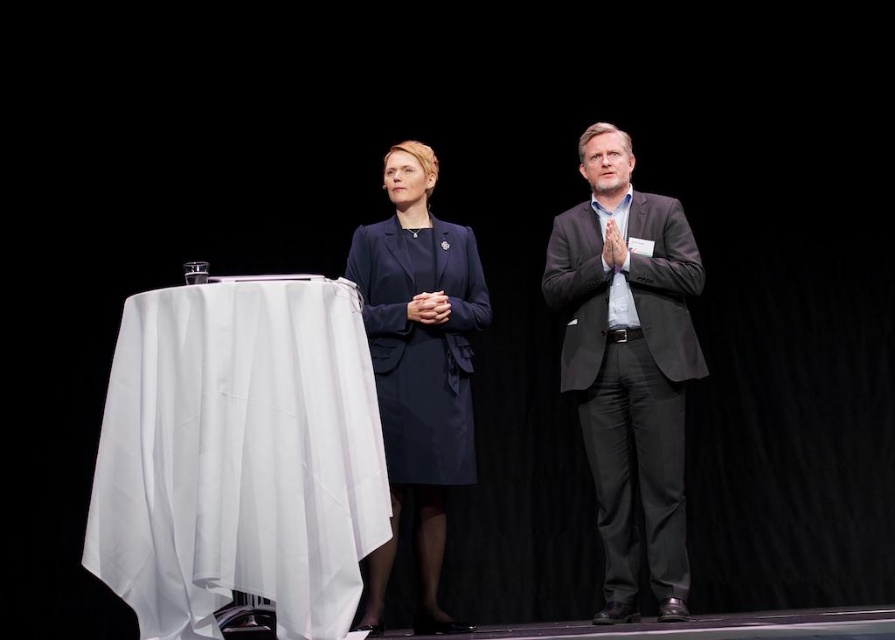
Which is above, white cloth-covered table at left or navy blue fabric coat at center?

navy blue fabric coat at center is higher up.

Between white cloth-covered table at left and navy blue fabric coat at center, which one appears on the right side from the viewer's perspective?

From the viewer's perspective, navy blue fabric coat at center appears more on the right side.

Which is in front, point (223, 544) or point (470, 424)?

Point (223, 544)

Where is `white cloth-covered table at left`? Image resolution: width=895 pixels, height=640 pixels. white cloth-covered table at left is located at coordinates (239, 456).

Does point (611, 298) come farther from viewer compared to point (367, 604)?

Yes, point (611, 298) is farther from viewer.

Where is `dark gray suit at center`? This screenshot has height=640, width=895. dark gray suit at center is located at coordinates (628, 364).

Is white cloth-covered table at left above dark gray suit at center?

Incorrect, white cloth-covered table at left is not positioned above dark gray suit at center.

Which is in front, point (154, 596) or point (624, 276)?

Point (154, 596) is more forward.

I want to click on white cloth-covered table at left, so click(239, 456).